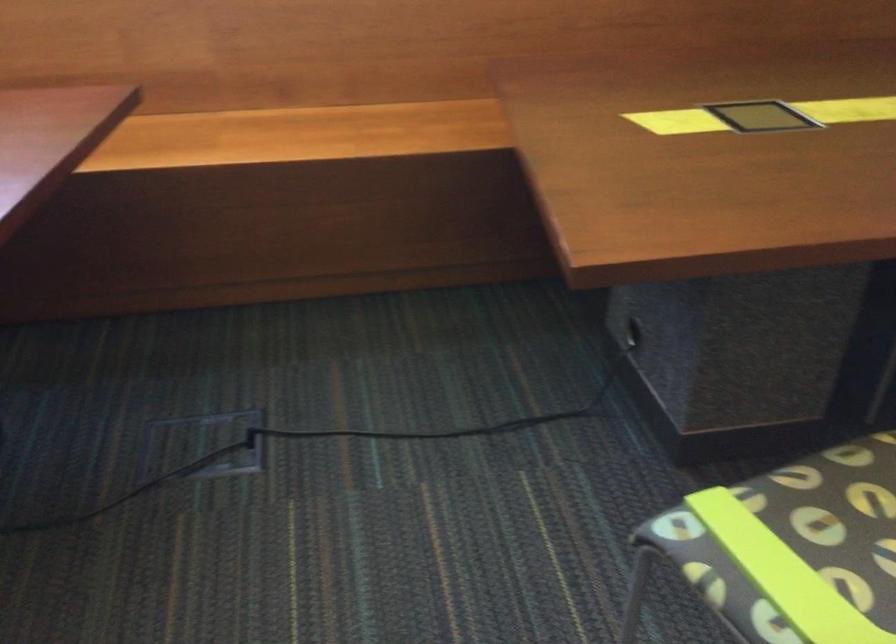
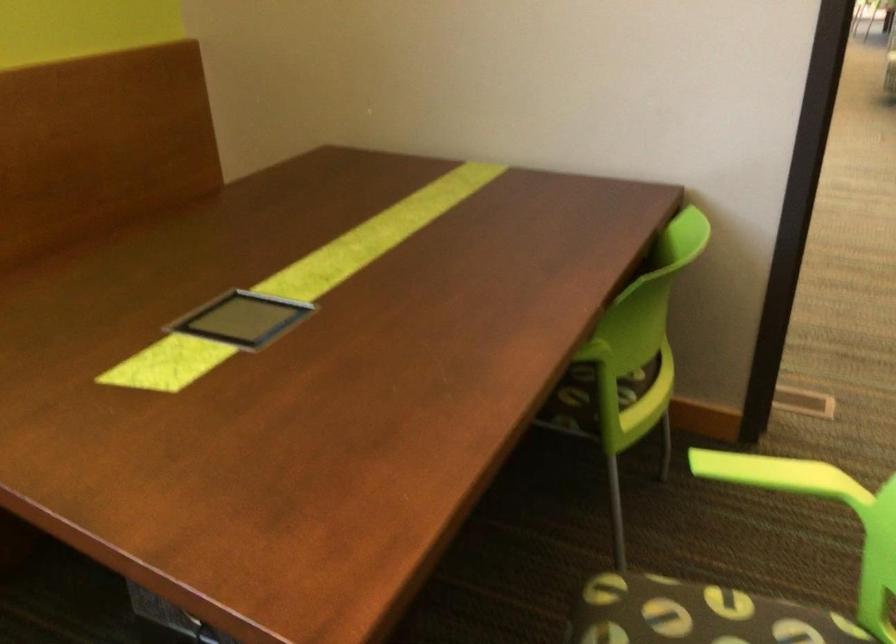
Question: The camera is either moving clockwise (left) or counter-clockwise (right) around the object. The first image is from the beginning of the video and the second image is from the end. Is the camera moving left or right when shooting the video?

Choices:
 (A) Left
 (B) Right

Answer: (A)